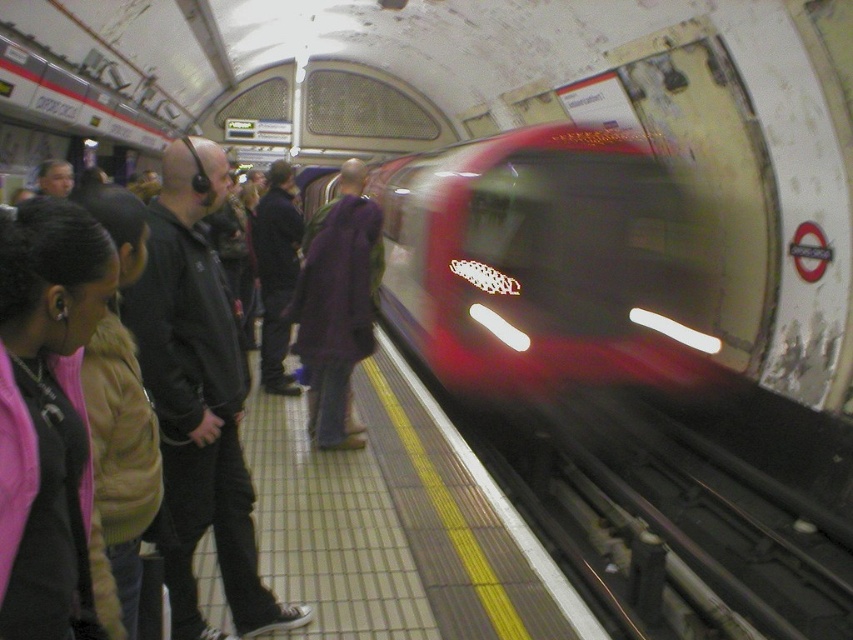
Which is more to the right, black leather jacket at left or purple wool coat at center?

purple wool coat at center is more to the right.

Locate an element on the screen. black leather jacket at left is located at coordinates (198, 397).

What are the coordinates of `black leather jacket at left` in the screenshot? It's located at 198,397.

Can you confirm if purple wool coat at center is thinner than purple fabric jacket at center?

Incorrect, purple wool coat at center's width is not less than purple fabric jacket at center's.

Who is lower down, purple wool coat at center or purple fabric jacket at center?

purple wool coat at center is lower down.

Is point (340, 195) positioned behind point (271, 330)?

That is False.

You are a GUI agent. You are given a task and a screenshot of the screen. Output one action in this format:
    pyautogui.click(x=<x>, y=<y>)
    Task: Click on the purple wool coat at center
    This screenshot has height=640, width=853.
    Given the screenshot: What is the action you would take?
    pyautogui.click(x=337, y=305)

Does point (212, 392) come behind point (287, 284)?

No, (212, 392) is in front of (287, 284).

Find the location of a particular element. black leather jacket at left is located at coordinates (198, 397).